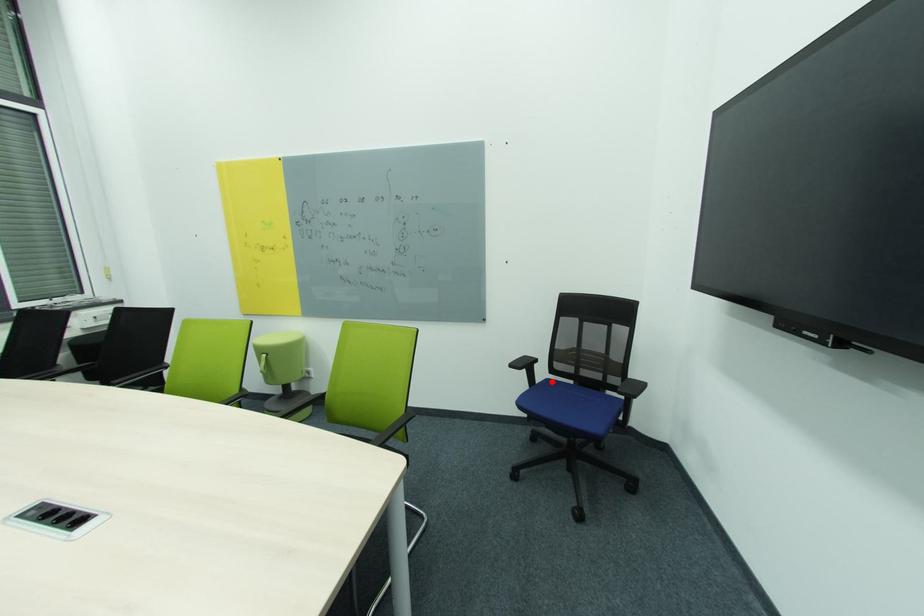
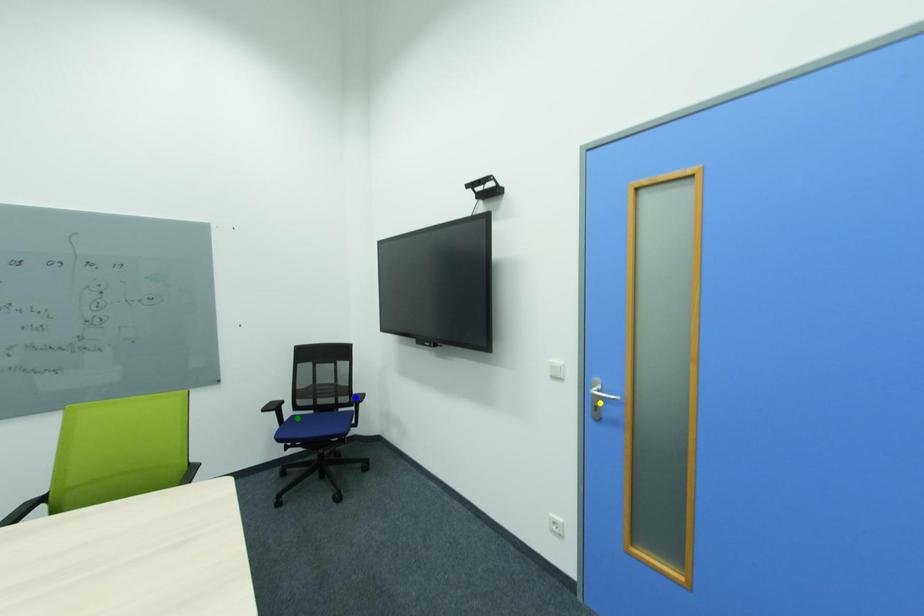
Question: I am providing you with two images of the same scene from different viewpoints. A red point is marked on the first image. You are given multiple points on the second image. Which mark in image 2 goes with the point in image 1?

Choices:
 (A) blue point
 (B) yellow point
 (C) green point

Answer: (C)